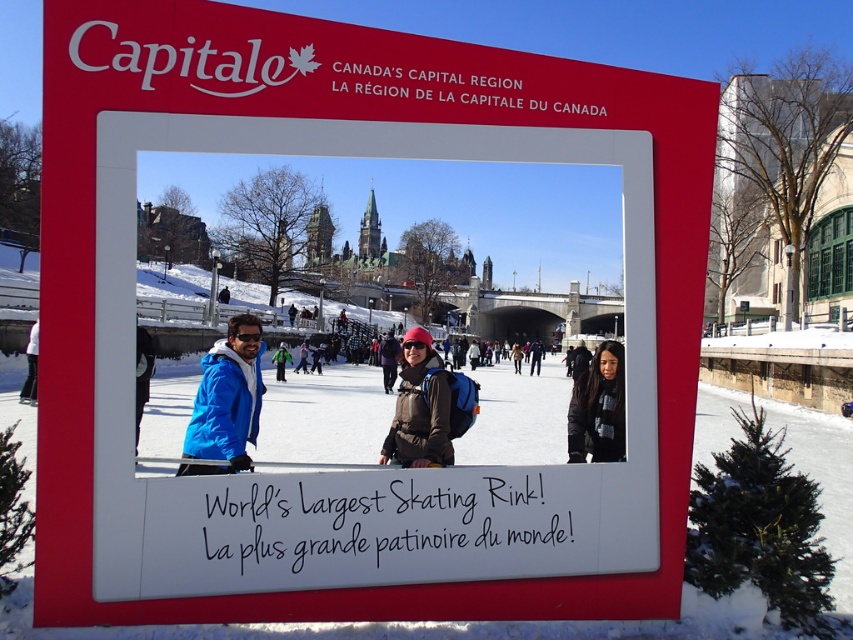
You are standing in front of the signboard and looking at the photo of the skating rink. In the photo, there are two people wearing a brown matte jacket at center and a green snowsuit at center. Which one is closer to you?

The brown matte jacket at center is closer to the viewer than the green snowsuit at center.

You are looking at the photo on the signboard. There are two points marked in the photo. Point A is at coordinate point(x=444, y=413) and Point B is at point(x=283, y=376). Which point is closer to the camera?

Point A at point(x=444, y=413) is closer to the camera than point B at point(x=283, y=376).